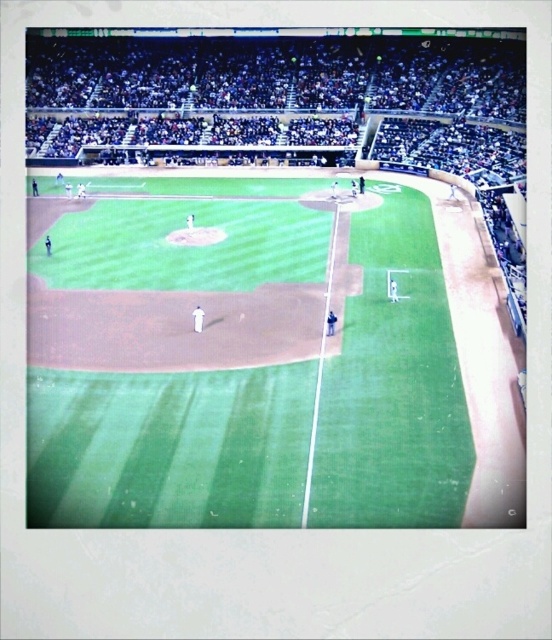
Which is behind, point (130, 508) or point (421, 108)?

Point (421, 108)

Does point (294, 433) come in front of point (256, 84)?

That is True.

At what (x,y) coordinates should I click in order to perform the action: click on green grass field at center. Please return your answer as a coordinate pair (x, y). Image resolution: width=552 pixels, height=640 pixels. Looking at the image, I should click on (240, 358).